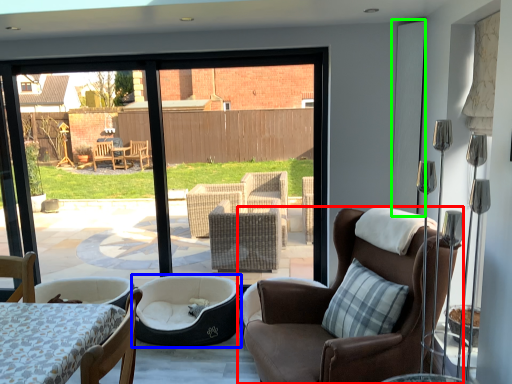
Question: Considering the real-world distances, which object is closest to chair (highlighted by a red box)? dog bed (highlighted by a blue box) or screen door (highlighted by a green box).

Choices:
 (A) dog bed
 (B) screen door

Answer: (A)